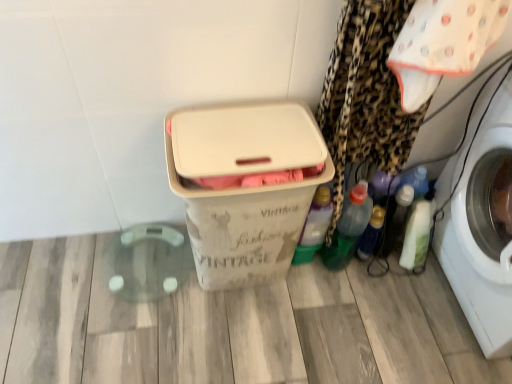
Where is `blank space to the left of green plastic bottle at lower right, the 3th bottle viewed from the right`? blank space to the left of green plastic bottle at lower right, the 3th bottle viewed from the right is located at coordinates (306, 274).